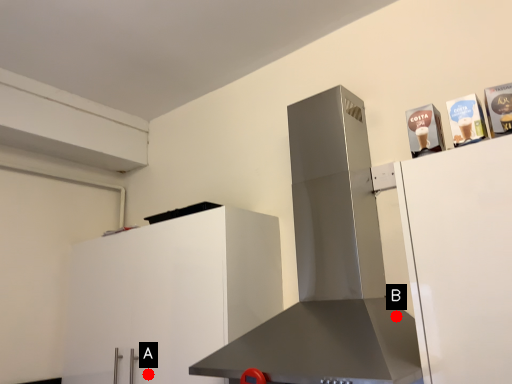
Question: Two points are circled on the image, labeled by A and B beside each circle. Among these points, which one is farthest from the camera?

Choices:
 (A) A is further
 (B) B is further

Answer: (A)